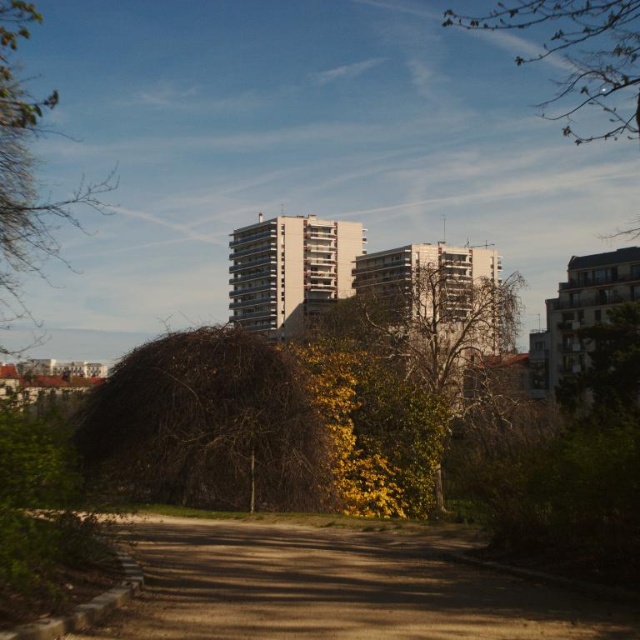
Is brown dirt path at lower center positioned at the back of brown textured bush at left?

No, it is not.

Is point (147, 568) farther from viewer compared to point (49, 244)?

No, it is in front of (49, 244).

Who is more forward, [451,614] or [32,180]?

Point [451,614] is more forward.

Locate an element on the screen. Image resolution: width=640 pixels, height=640 pixels. brown dirt path at lower center is located at coordinates (337, 588).

Is brown dirt path at lower center positioned behind brown textured tree at center?

No, it is not.

This screenshot has width=640, height=640. Describe the element at coordinates (337, 588) in the screenshot. I see `brown dirt path at lower center` at that location.

Describe the element at coordinates (337, 588) in the screenshot. I see `brown dirt path at lower center` at that location.

Where is `brown dirt path at lower center`? The width and height of the screenshot is (640, 640). brown dirt path at lower center is located at coordinates (337, 588).

From the picture: Is brown textured tree at center bigger than brown textured bush at left?

No.

Between point (77, 445) and point (3, 109), which one is positioned in front?

Point (3, 109) is in front.

Who is more forward, (163, 499) or (22, 212)?

Positioned in front is point (22, 212).

Identify the location of brown textured tree at center. The width and height of the screenshot is (640, 640). (205, 426).